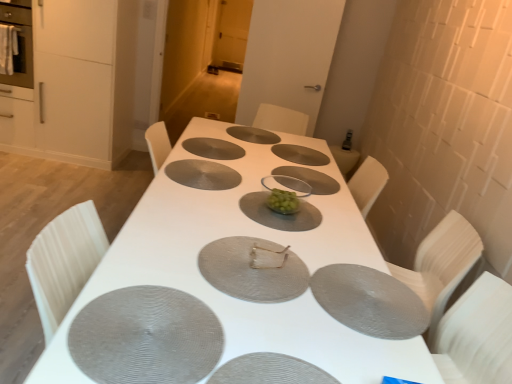
Find the location of a particular element. This screenshot has height=384, width=512. free location in front of green matte platter at center is located at coordinates (291, 241).